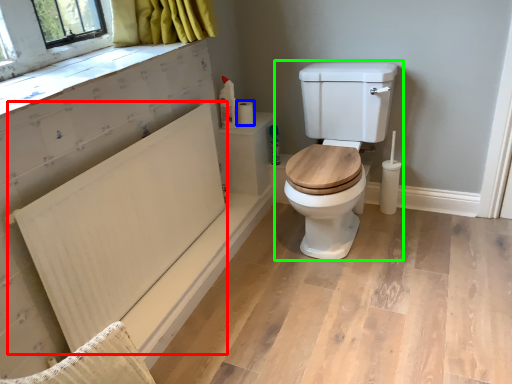
Question: Which object is positioned closest to radiator (highlighted by a red box)? Select from toilet paper (highlighted by a blue box) and toilet (highlighted by a green box).

Choices:
 (A) toilet paper
 (B) toilet

Answer: (B)